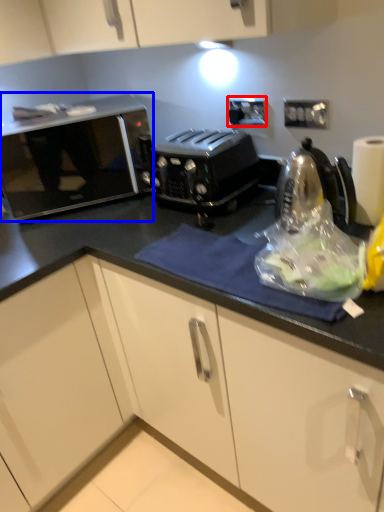
Question: Which point is further to the camera, electric outlet (highlighted by a red box) or home appliance (highlighted by a blue box)?

Choices:
 (A) electric outlet
 (B) home appliance

Answer: (A)